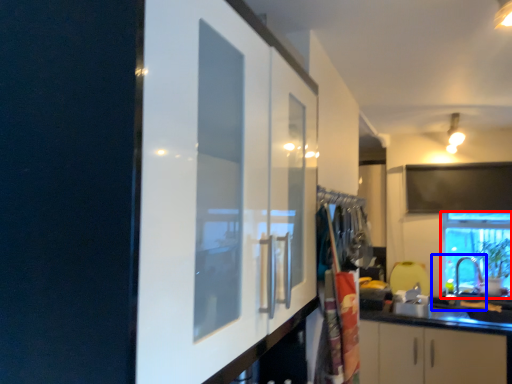
Question: Among these objects, which one is farthest to the camera, window (highlighted by a red box) or sink (highlighted by a blue box)?

Choices:
 (A) window
 (B) sink

Answer: (A)